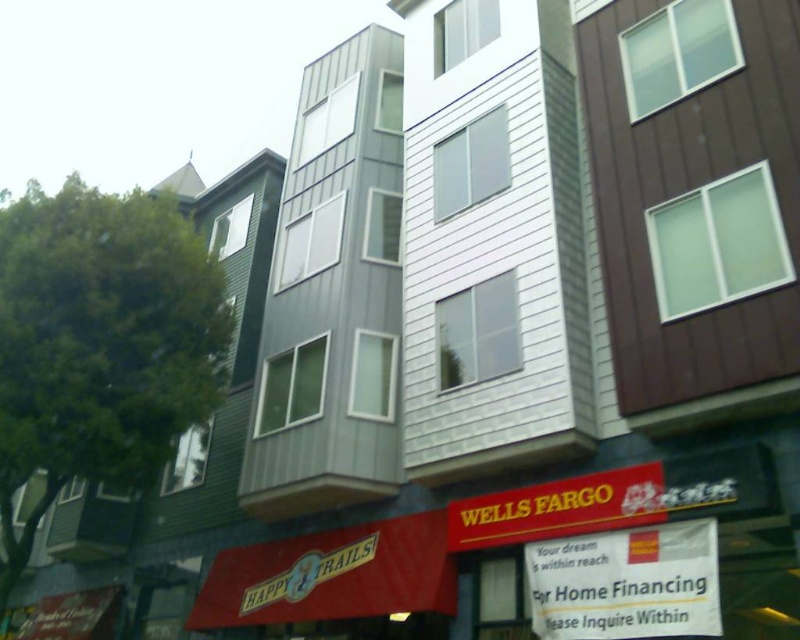
You are a pedestrian standing on the street looking at the storefronts. You see two signs at lower center. Which sign is positioned lower between the white paper sign at lower center and the yellow matte sign at lower center?

The white paper sign at lower center is positioned below the yellow matte sign at lower center, so the white paper sign at lower center is the lower one.